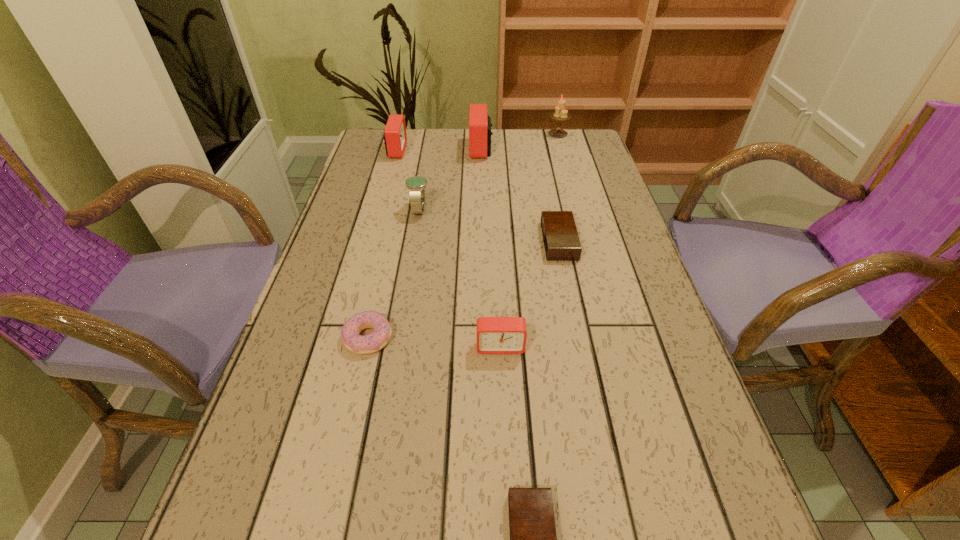
The height and width of the screenshot is (540, 960). What are the coordinates of `free space located on the front face of the right black alarm clock` in the screenshot? It's located at (387, 241).

Find the location of `vacant area situated 0.110m on the left of the doughnut`. vacant area situated 0.110m on the left of the doughnut is located at coordinates (287, 338).

Locate an element on the screen. candle holder at the far edge is located at coordinates (560, 114).

You are a GUI agent. You are given a task and a screenshot of the screen. Output one action in this format:
    pyautogui.click(x=<x>, y=<y>)
    Task: Click on the alarm clock present at the left edge
    The image size is (960, 540).
    Given the screenshot: What is the action you would take?
    pyautogui.click(x=395, y=138)

What are the coordinates of `doughnut that is at the left edge` in the screenshot? It's located at (361, 344).

You are a GUI agent. You are given a task and a screenshot of the screen. Output one action in this format:
    pyautogui.click(x=<x>, y=<y>)
    Task: Click on the candle holder present at the right edge
    The height and width of the screenshot is (540, 960).
    Given the screenshot: What is the action you would take?
    pyautogui.click(x=560, y=114)

The image size is (960, 540). Find the location of `alarm clock located in the right edge section of the desktop`. alarm clock located in the right edge section of the desktop is located at coordinates (561, 241).

Locate an element on the screen. The width and height of the screenshot is (960, 540). object present at the far left corner is located at coordinates (395, 138).

Find the location of a particular element. object present at the far right corner is located at coordinates pyautogui.click(x=560, y=114).

Identify the location of vacant region at the far edge. (538, 136).